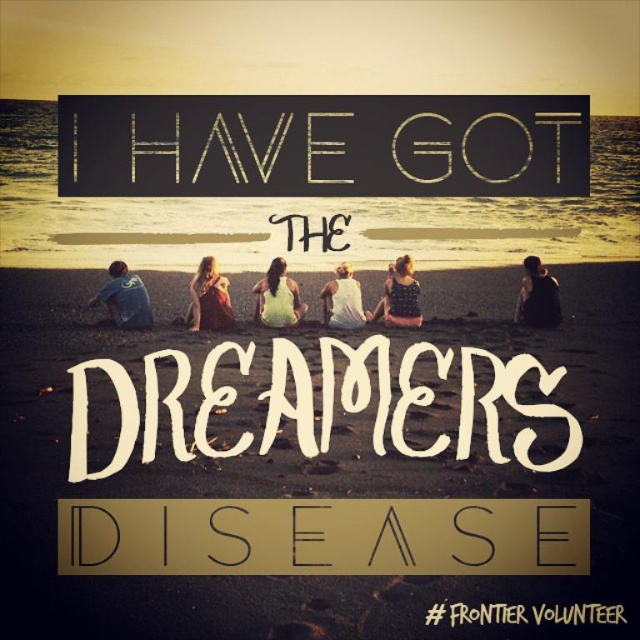
Is point (292, 282) positioned after point (323, 305)?

That is True.

At what (x,y) coordinates should I click in order to perform the action: click on yellow fabric dress at center. Please return your answer as a coordinate pair (x, y). The width and height of the screenshot is (640, 640). Looking at the image, I should click on (276, 298).

Can you confirm if black matte tank top at center is wider than white cotton shirt at center?

Yes.

Can you confirm if black matte tank top at center is thinner than white cotton shirt at center?

No, black matte tank top at center is not thinner than white cotton shirt at center.

Is point (529, 296) closer to camera compared to point (323, 289)?

No.

I want to click on black matte tank top at center, so click(x=538, y=296).

Is blonde hair fabric at center thinner than patterned fabric dress at center?

Yes.

Consider the image. Can you confirm if blonde hair fabric at center is bigger than patterned fabric dress at center?

Correct, blonde hair fabric at center is larger in size than patterned fabric dress at center.

What do you see at coordinates (209, 298) in the screenshot? I see `blonde hair fabric at center` at bounding box center [209, 298].

I want to click on blonde hair fabric at center, so click(x=209, y=298).